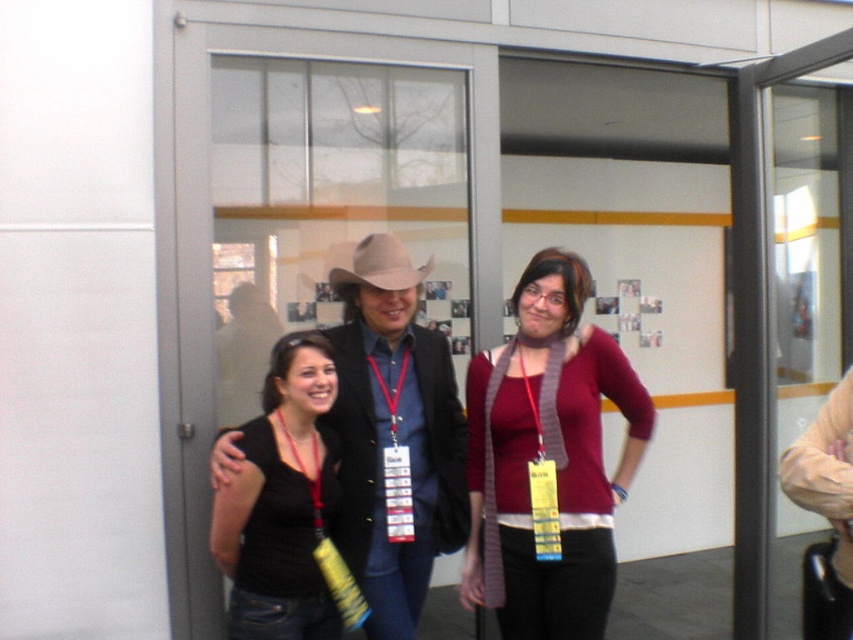
Does matte red sweater at center appear on the right side of matte black jacket at center?

Yes, matte red sweater at center is to the right of matte black jacket at center.

Measure the distance from matte red sweater at center to matte black jacket at center.

matte red sweater at center is 10.43 inches from matte black jacket at center.

Measure the distance between matte red sweater at center and camera.

A distance of 2.40 meters exists between matte red sweater at center and camera.

Where is `matte red sweater at center`? The width and height of the screenshot is (853, 640). matte red sweater at center is located at coordinates click(548, 460).

Does black matte shirt at center have a smaller size compared to light brown felt cowboy hat at center?

No, black matte shirt at center is not smaller than light brown felt cowboy hat at center.

Consider the image. Is black matte shirt at center above light brown felt cowboy hat at center?

No, black matte shirt at center is not above light brown felt cowboy hat at center.

Who is more forward, (294, 387) or (381, 253)?

Point (294, 387) is more forward.

This screenshot has width=853, height=640. I want to click on black matte shirt at center, so click(283, 506).

Between point (608, 486) and point (323, 346), which one is positioned in front?

Positioned in front is point (323, 346).

Who is higher up, matte red sweater at center or black matte shirt at center?

matte red sweater at center is higher up.

Who is more forward, (x=537, y=387) or (x=315, y=580)?

Point (x=315, y=580) is more forward.

Locate an element on the screen. This screenshot has height=640, width=853. matte red sweater at center is located at coordinates (548, 460).